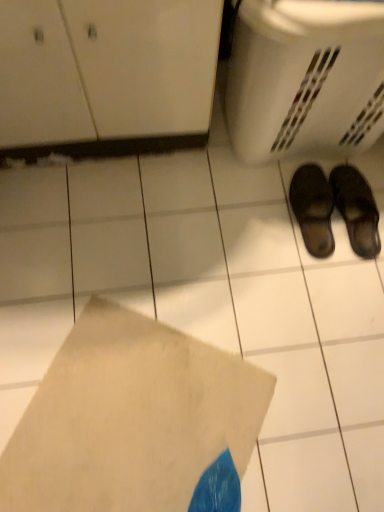
Question: Is black leather slippers at lower right, which ranks as the second footwear in right-to-left order, a part of white matte envelope at lower center?

Choices:
 (A) no
 (B) yes

Answer: (A)

Question: Is white matte envelope at lower center directly adjacent to black leather slippers at lower right, which ranks as the second footwear in right-to-left order?

Choices:
 (A) yes
 (B) no

Answer: (B)

Question: From a real-world perspective, is white matte envelope at lower center physically below black leather slippers at lower right, which ranks as the second footwear in right-to-left order?

Choices:
 (A) no
 (B) yes

Answer: (B)

Question: Is white matte envelope at lower center at the left side of black leather slippers at lower right, which ranks as the second footwear in right-to-left order?

Choices:
 (A) no
 (B) yes

Answer: (B)

Question: Is white matte envelope at lower center not close to black leather slippers at lower right, which ranks as the second footwear in right-to-left order?

Choices:
 (A) no
 (B) yes

Answer: (A)

Question: Can you confirm if white matte envelope at lower center is positioned to the right of black leather slippers at lower right, which is the 1th footwear from left to right?

Choices:
 (A) yes
 (B) no

Answer: (B)

Question: Are black leather slippers at lower right, which is the 1th footwear from left to right, and white plastic basket at lower right far apart?

Choices:
 (A) yes
 (B) no

Answer: (B)

Question: Considering the relative sizes of black leather slippers at lower right, which is the 1th footwear from left to right, and white plastic basket at lower right in the image provided, is black leather slippers at lower right, which is the 1th footwear from left to right, taller than white plastic basket at lower right?

Choices:
 (A) no
 (B) yes

Answer: (A)

Question: Considering the relative positions of black leather slippers at lower right, which is the 1th footwear from left to right, and white plastic basket at lower right in the image provided, is black leather slippers at lower right, which is the 1th footwear from left to right, to the right of white plastic basket at lower right from the viewer's perspective?

Choices:
 (A) yes
 (B) no

Answer: (A)

Question: From the image's perspective, is black leather slippers at lower right, which is the 1th footwear from left to right, below white plastic basket at lower right?

Choices:
 (A) yes
 (B) no

Answer: (A)

Question: Is white plastic basket at lower right located within black leather slippers at lower right, which ranks as the second footwear in right-to-left order?

Choices:
 (A) yes
 (B) no

Answer: (B)

Question: Is black leather slippers at lower right, which is the 1th footwear from left to right, further to camera compared to white plastic basket at lower right?

Choices:
 (A) yes
 (B) no

Answer: (A)

Question: Is leather slipper at lower right, the second footwear when ordered from left to right, surrounded by white matte envelope at lower center?

Choices:
 (A) no
 (B) yes

Answer: (A)